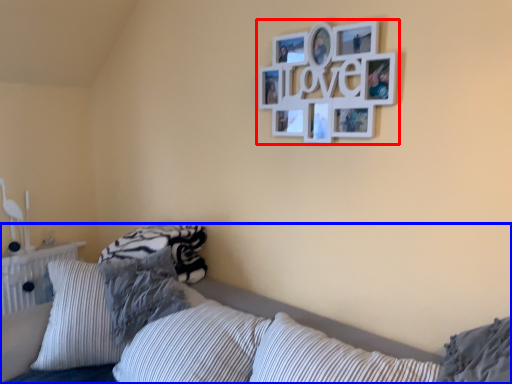
Question: Which of the following is the farthest to the observer, picture frame (highlighted by a red box) or bed (highlighted by a blue box)?

Choices:
 (A) picture frame
 (B) bed

Answer: (A)